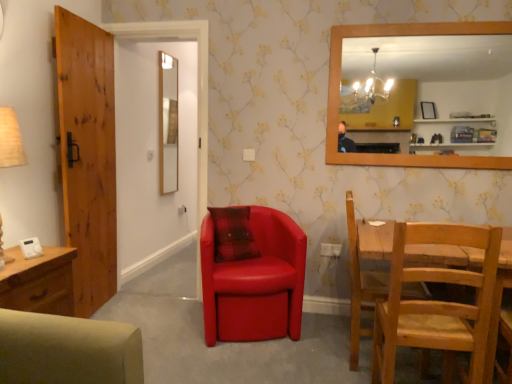
Find the location of a particular element. This screenshot has width=512, height=384. matte red leather armchair at center, which is the first chair from left to right is located at coordinates (255, 282).

Describe the element at coordinates (365, 271) in the screenshot. I see `light brown wooden chair at lower right, positioned as the 1th chair in right-to-left order` at that location.

Describe the element at coordinates (87, 155) in the screenshot. The width and height of the screenshot is (512, 384). I see `wooden door at left` at that location.

Measure the distance between point (88,223) and camera.

Point (88,223) and camera are 2.83 meters apart from each other.

Describe the element at coordinates (439, 83) in the screenshot. I see `wooden frame mirror at upper right, the 2th mirror in the back-to-front sequence` at that location.

Measure the distance between point (346, 81) and camera.

The distance of point (346, 81) from camera is 6.92 meters.

Identify the location of beige paper table lamp at left. The height and width of the screenshot is (384, 512). (10, 140).

From the image's perspective, does wooden door at left appear higher than matte red leather armchair at center, which is the first chair from left to right?

Correct, wooden door at left appears higher than matte red leather armchair at center, which is the first chair from left to right, in the image.

From a real-world perspective, does wooden door at left sit lower than matte red leather armchair at center, which is the first chair from left to right?

Actually, wooden door at left is physically above matte red leather armchair at center, which is the first chair from left to right, in the real world.

Can you confirm if wooden door at left is thinner than matte red leather armchair at center, which is the first chair from left to right?

Yes, wooden door at left is thinner than matte red leather armchair at center, which is the first chair from left to right.

Considering the relative sizes of wooden door at left and matte red leather armchair at center, the 2th chair viewed from the right, in the image provided, is wooden door at left smaller than matte red leather armchair at center, the 2th chair viewed from the right,?

Indeed, wooden door at left has a smaller size compared to matte red leather armchair at center, the 2th chair viewed from the right.

From a real-world perspective, is smooth wooden mirror at center, the second mirror from the front, positioned under matte red leather armchair at center, the 2th chair viewed from the right, based on gravity?

No.

Would you say matte red leather armchair at center, the 2th chair viewed from the right, is part of smooth wooden mirror at center, the second mirror from the right,'s contents?

No, matte red leather armchair at center, the 2th chair viewed from the right, is not inside smooth wooden mirror at center, the second mirror from the right.

Is smooth wooden mirror at center, which appears as the 1th mirror when viewed from the back, directly adjacent to matte red leather armchair at center, which is the first chair from left to right?

No, smooth wooden mirror at center, which appears as the 1th mirror when viewed from the back, is not in contact with matte red leather armchair at center, which is the first chair from left to right.

From the image's perspective, is smooth wooden mirror at center, the second mirror from the front, on matte red leather armchair at center, the 2th chair viewed from the right?

Yes, from the image's perspective, smooth wooden mirror at center, the second mirror from the front, is over matte red leather armchair at center, the 2th chair viewed from the right.

Between matte red leather armchair at center, the 2th chair viewed from the right, and smooth wooden mirror at center, the second mirror from the front, which one appears on the left side from the viewer's perspective?

Positioned to the left is smooth wooden mirror at center, the second mirror from the front.

Which is further, (255, 225) or (175, 81)?

The point (175, 81) is more distant.

Could you tell me if matte red leather armchair at center, which is the first chair from left to right, is turned towards smooth wooden mirror at center, the second mirror from the front?

No, matte red leather armchair at center, which is the first chair from left to right, is not turned towards smooth wooden mirror at center, the second mirror from the front.

Does beige paper table lamp at left appear on the right side of matte red leather armchair at center, the 2th chair viewed from the right?

No.

Would you say beige paper table lamp at left is a long distance from matte red leather armchair at center, which is the first chair from left to right?

beige paper table lamp at left is far away from matte red leather armchair at center, which is the first chair from left to right.

Is point (4, 108) farther from viewer compared to point (272, 267)?

No, it is in front of (272, 267).

From the image's perspective, which is above, beige paper table lamp at left or matte red leather armchair at center, which is the first chair from left to right?

beige paper table lamp at left is shown above in the image.

From a real-world perspective, is wooden frame mirror at upper right, the 1th mirror from the right, positioned over matte red leather armchair at center, which is the first chair from left to right, based on gravity?

Correct, in the physical world, wooden frame mirror at upper right, the 1th mirror from the right, is higher than matte red leather armchair at center, which is the first chair from left to right.

Is wooden frame mirror at upper right, the first mirror viewed from the front, closer to the viewer compared to matte red leather armchair at center, which is the first chair from left to right?

No, wooden frame mirror at upper right, the first mirror viewed from the front, is behind matte red leather armchair at center, which is the first chair from left to right.

From the image's perspective, is wooden frame mirror at upper right, the second mirror in the left-to-right sequence, under matte red leather armchair at center, the 2th chair viewed from the right?

Incorrect, from the image's perspective, wooden frame mirror at upper right, the second mirror in the left-to-right sequence, is higher than matte red leather armchair at center, the 2th chair viewed from the right.

Is wooden frame mirror at upper right, the first mirror viewed from the front, inside or outside of matte red leather armchair at center, the 2th chair viewed from the right?

wooden frame mirror at upper right, the first mirror viewed from the front, is outside matte red leather armchair at center, the 2th chair viewed from the right.

Does light brown wooden chair at lower right, arranged as the 2th chair when viewed from the left, have a lesser height compared to smooth wooden mirror at center, which appears as the 1th mirror when viewed from the back?

Yes.

Which object is thinner, light brown wooden chair at lower right, positioned as the 1th chair in right-to-left order, or smooth wooden mirror at center, which appears as the first mirror when viewed from the left?

smooth wooden mirror at center, which appears as the first mirror when viewed from the left.

In the scene shown: Can you tell me how much light brown wooden chair at lower right, arranged as the 2th chair when viewed from the left, and smooth wooden mirror at center, the second mirror from the right, differ in facing direction?

The facing directions of light brown wooden chair at lower right, arranged as the 2th chair when viewed from the left, and smooth wooden mirror at center, the second mirror from the right, are 2.66 degrees apart.

Based on the photo, from a real-world perspective, is light brown wooden chair at lower right, positioned as the 1th chair in right-to-left order, positioned above or below smooth wooden mirror at center, the second mirror from the front?

Clearly, from a real-world perspective, light brown wooden chair at lower right, positioned as the 1th chair in right-to-left order, is below smooth wooden mirror at center, the second mirror from the front.

Which point is more distant from viewer, (477, 119) or (71, 84)?

The point (477, 119) is farther from the camera.

Who is shorter, wooden frame mirror at upper right, the first mirror viewed from the front, or wooden door at left?

With less height is wooden frame mirror at upper right, the first mirror viewed from the front.

From the image's perspective, between wooden frame mirror at upper right, the 2th mirror in the back-to-front sequence, and wooden door at left, who is located below?

wooden door at left appears lower in the image.

Where is `door that is on the left side of matte red leather armchair at center, the 2th chair viewed from the right`? The height and width of the screenshot is (384, 512). door that is on the left side of matte red leather armchair at center, the 2th chair viewed from the right is located at coordinates (87, 155).

This screenshot has width=512, height=384. I want to click on the 1st chair in front of the smooth wooden mirror at center, which appears as the first mirror when viewed from the left, so click(x=255, y=282).

Estimate the real-world distances between objects in this image. Which object is further from smooth wooden mirror at center, which appears as the 1th mirror when viewed from the back, beige paper table lamp at left or wooden frame mirror at upper right, the first mirror viewed from the front?

Among the two, wooden frame mirror at upper right, the first mirror viewed from the front, is located further to smooth wooden mirror at center, which appears as the 1th mirror when viewed from the back.

Estimate the real-world distances between objects in this image. Which object is further from wooden door at left, smooth wooden mirror at center, which appears as the first mirror when viewed from the left, or matte red leather armchair at center, the 2th chair viewed from the right?

Among the two, smooth wooden mirror at center, which appears as the first mirror when viewed from the left, is located further to wooden door at left.

When comparing their distances from matte red leather armchair at center, the 2th chair viewed from the right, does wooden frame mirror at upper right, the 2th mirror in the back-to-front sequence, or smooth wooden mirror at center, the second mirror from the right, seem further?

Among the two, wooden frame mirror at upper right, the 2th mirror in the back-to-front sequence, is located further to matte red leather armchair at center, the 2th chair viewed from the right.

Based on their spatial positions, is wooden frame mirror at upper right, the 2th mirror in the back-to-front sequence, or light brown wooden chair at lower right, arranged as the 2th chair when viewed from the left, closer to matte red leather armchair at center, the 2th chair viewed from the right?

The object closer to matte red leather armchair at center, the 2th chair viewed from the right, is light brown wooden chair at lower right, arranged as the 2th chair when viewed from the left.

Estimate the real-world distances between objects in this image. Which object is further from wooden door at left, matte red leather armchair at center, the 2th chair viewed from the right, or light brown wooden chair at lower right, arranged as the 2th chair when viewed from the left?

The object further to wooden door at left is light brown wooden chair at lower right, arranged as the 2th chair when viewed from the left.

Based on their spatial positions, is light brown wooden chair at lower right, arranged as the 2th chair when viewed from the left, or matte red leather armchair at center, which is the first chair from left to right, further from wooden door at left?

Among the two, light brown wooden chair at lower right, arranged as the 2th chair when viewed from the left, is located further to wooden door at left.

When comparing their distances from light brown wooden chair at lower right, positioned as the 1th chair in right-to-left order, does beige paper table lamp at left or matte red leather armchair at center, the 2th chair viewed from the right, seem closer?

matte red leather armchair at center, the 2th chair viewed from the right, is positioned closer to the anchor light brown wooden chair at lower right, positioned as the 1th chair in right-to-left order.

From the image, which object appears to be farther from light brown wooden chair at lower right, arranged as the 2th chair when viewed from the left, wooden frame mirror at upper right, the first mirror viewed from the front, or wooden door at left?

The object further to light brown wooden chair at lower right, arranged as the 2th chair when viewed from the left, is wooden frame mirror at upper right, the first mirror viewed from the front.

Locate an element on the screen. The image size is (512, 384). door between beige paper table lamp at left and smooth wooden mirror at center, which appears as the first mirror when viewed from the left, from front to back is located at coordinates (87, 155).

Image resolution: width=512 pixels, height=384 pixels. I want to click on mirror between beige paper table lamp at left and wooden frame mirror at upper right, the 1th mirror from the right, in the horizontal direction, so click(x=168, y=123).

Image resolution: width=512 pixels, height=384 pixels. I want to click on door between light brown wooden chair at lower right, positioned as the 1th chair in right-to-left order, and smooth wooden mirror at center, which appears as the 1th mirror when viewed from the back, in the front-back direction, so click(x=87, y=155).

Where is `chair between wooden frame mirror at upper right, the second mirror in the left-to-right sequence, and matte red leather armchair at center, the 2th chair viewed from the right, from top to bottom`? Image resolution: width=512 pixels, height=384 pixels. chair between wooden frame mirror at upper right, the second mirror in the left-to-right sequence, and matte red leather armchair at center, the 2th chair viewed from the right, from top to bottom is located at coordinates (365, 271).